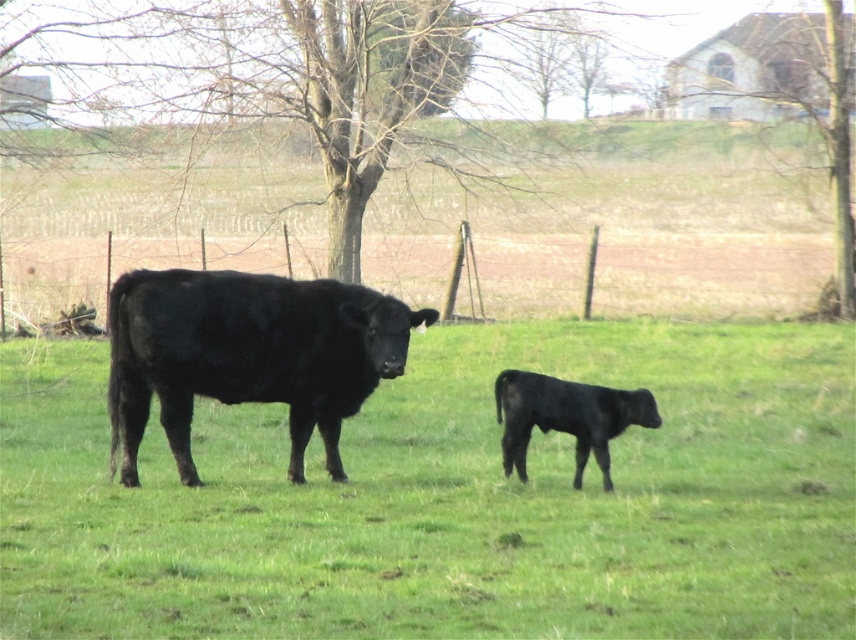
Question: Is bare wood tree at center thinner than shiny black bull at center?

Choices:
 (A) no
 (B) yes

Answer: (A)

Question: Is shiny black bull at center positioned at the back of black smooth calf at lower right?

Choices:
 (A) no
 (B) yes

Answer: (A)

Question: Can you confirm if bare wood tree at upper right is wider than black smooth calf at lower right?

Choices:
 (A) no
 (B) yes

Answer: (B)

Question: Which of the following is the closest to the observer?

Choices:
 (A) (532, 401)
 (B) (834, 177)
 (C) (141, 371)

Answer: (A)

Question: Which object is positioned farthest from the black smooth calf at lower right?

Choices:
 (A) green grass at center
 (B) shiny black bull at center
 (C) bare wood tree at upper right
 (D) bare wood tree at center

Answer: (C)

Question: Based on their relative distances, which object is farther from the green grass at center?

Choices:
 (A) shiny black bull at center
 (B) bare wood tree at upper right

Answer: (B)